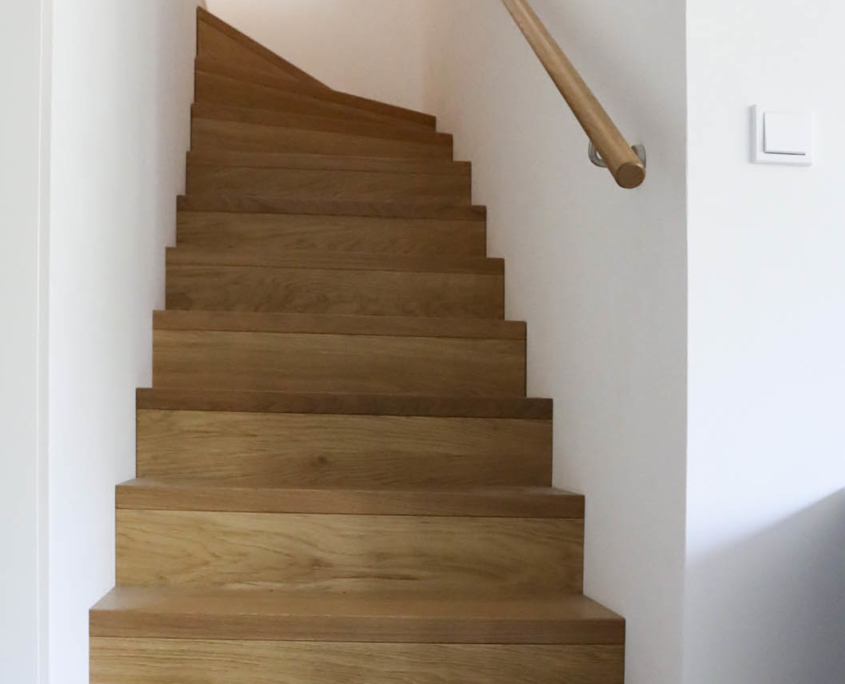
Locate an element on the screen. Image resolution: width=845 pixels, height=684 pixels. steps in staircase is located at coordinates (344, 611), (342, 488), (344, 406), (346, 319), (353, 259), (347, 211), (345, 166), (333, 129), (313, 92), (252, 50).